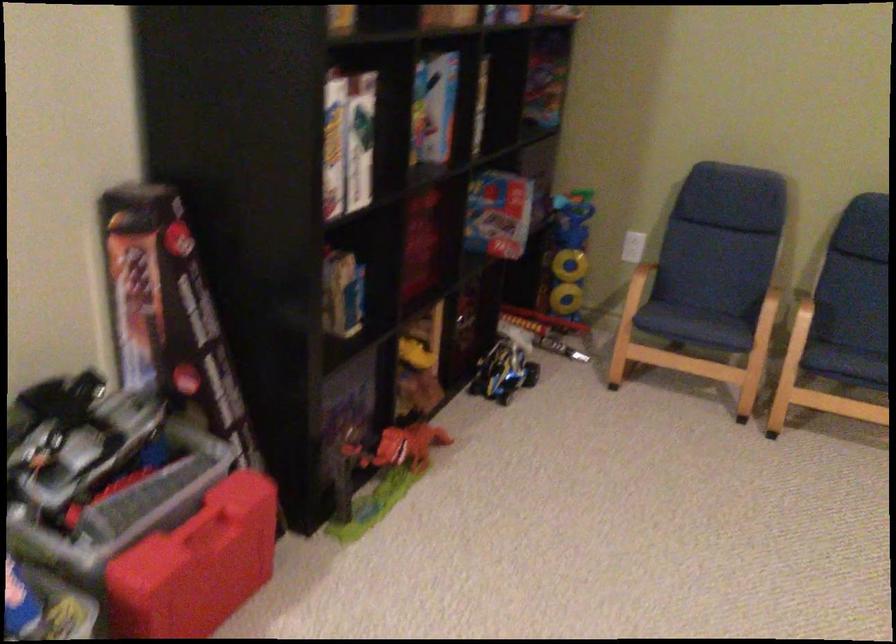
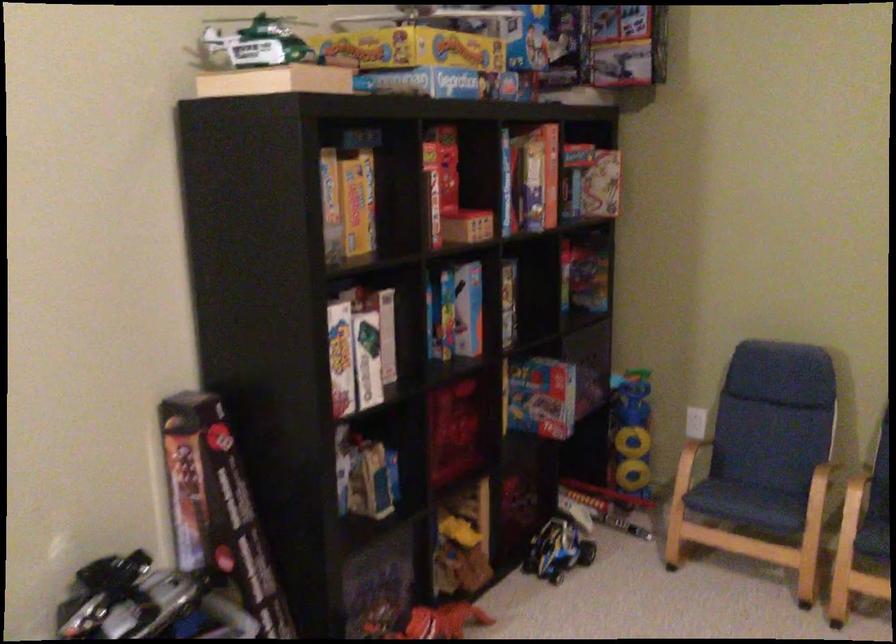
Locate, in the second image, the point that corresponds to pixel 804 301 in the first image.

(858, 480)